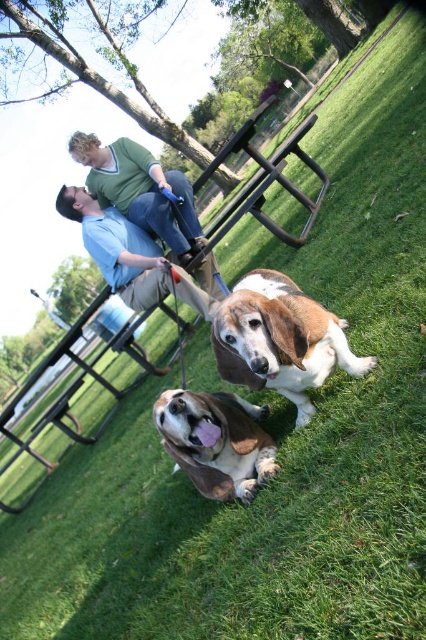
You are standing at the center of the image. Which direction should you move to reach the brown furry dog at lower center?

The brown furry dog at lower center is located at coordinates 0.691 on the x axis and 0.507 on the y axis. Since you are at the center of the image, which is at coordinates 0.5 on both axes, you should move to the right and slightly upwards to reach the brown furry dog at lower center.

You are standing at the picnic table in the park scene and want to throw a ball to a spot closer to you. Which of the two points, point (319, 387) or point (249, 472), should you aim for?

Point (319, 387) is further to the camera than point (249, 472), so to throw the ball to a spot closer to you, aim for point (249, 472).